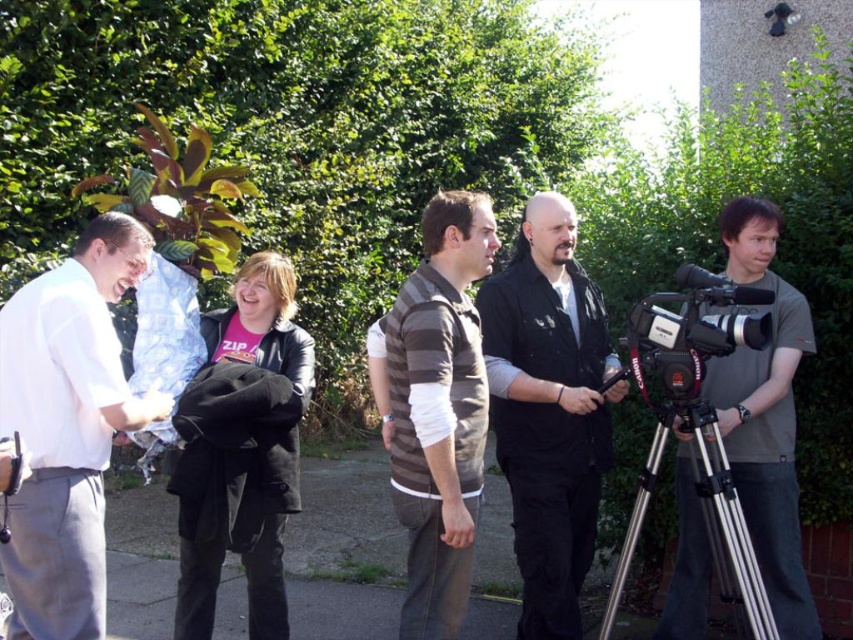
Question: Which point is closer to the camera taking this photo?

Choices:
 (A) (788, 392)
 (B) (422, 300)
 (C) (634, 307)
 (D) (532, 378)

Answer: (B)

Question: Which of the following is the farthest from the observer?

Choices:
 (A) black plastic video camera at right
 (B) silver metallic tripod at lower right
 (C) white shirt at left

Answer: (A)

Question: Is gray matte camera at right smaller than black plastic video camera at right?

Choices:
 (A) no
 (B) yes

Answer: (A)

Question: Can you confirm if black matte vest at center is bigger than black plastic video camera at right?

Choices:
 (A) yes
 (B) no

Answer: (A)

Question: Is white shirt at left to the left of black matte vest at center from the viewer's perspective?

Choices:
 (A) no
 (B) yes

Answer: (B)

Question: Which object is the closest to the striped jersey at center?

Choices:
 (A) black matte vest at center
 (B) white shirt at left
 (C) silver metallic tripod at lower right
 (D) gray matte camera at right

Answer: (A)